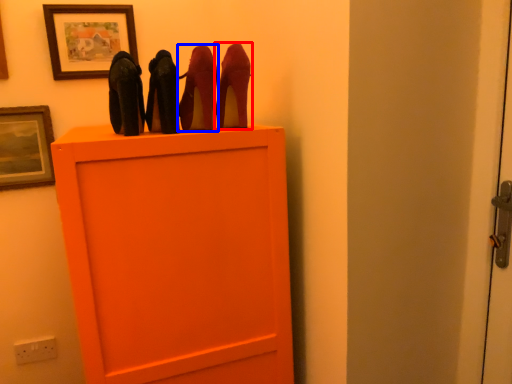
Question: Among these objects, which one is farthest to the camera, high heels (highlighted by a red box) or high heels (highlighted by a blue box)?

Choices:
 (A) high heels
 (B) high heels

Answer: (A)